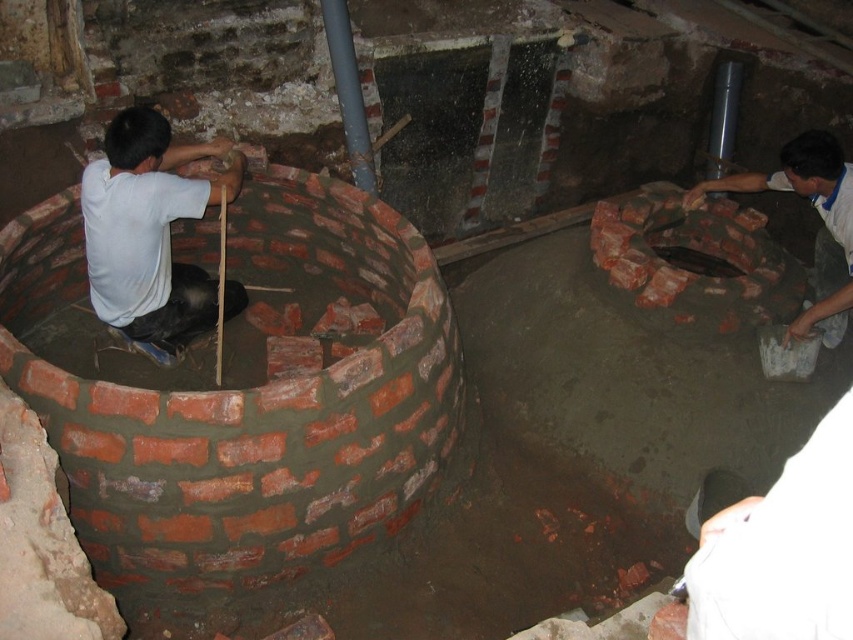
Question: Can you confirm if white matte shirt at left is bigger than smooth concrete hole at center?

Choices:
 (A) no
 (B) yes

Answer: (B)

Question: Among these points, which one is nearest to the camera?

Choices:
 (A) (711, 256)
 (B) (106, 244)
 (C) (842, 230)

Answer: (B)

Question: Among these points, which one is nearest to the camera?

Choices:
 (A) (711, 259)
 (B) (177, 296)
 (C) (833, 177)

Answer: (C)

Question: Does white matte shirt at left appear on the right side of smooth concrete hole at center?

Choices:
 (A) yes
 (B) no

Answer: (B)

Question: Considering the relative positions of white matte shirt at left and smooth concrete hole at center in the image provided, where is white matte shirt at left located with respect to smooth concrete hole at center?

Choices:
 (A) right
 (B) left

Answer: (B)

Question: Among these objects, which one is farthest from the camera?

Choices:
 (A) white matte shirt at upper right
 (B) white matte shirt at left

Answer: (A)